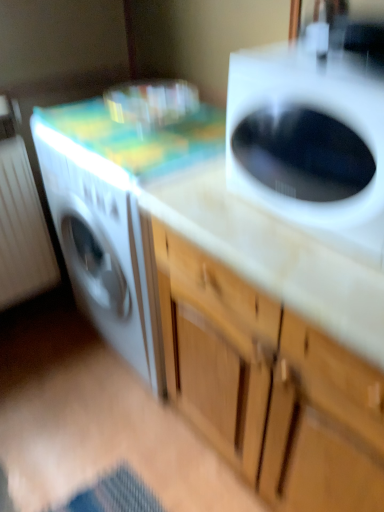
Question: Can you confirm if white glossy washing machine at upper right is positioned to the right of wooden cabinet at center?

Choices:
 (A) no
 (B) yes

Answer: (A)

Question: Is white glossy washing machine at upper right in front of wooden cabinet at center?

Choices:
 (A) no
 (B) yes

Answer: (A)

Question: Considering the relative sizes of white glossy washing machine at upper right and wooden cabinet at center in the image provided, is white glossy washing machine at upper right thinner than wooden cabinet at center?

Choices:
 (A) yes
 (B) no

Answer: (A)

Question: Is white glossy washing machine at upper right surrounding wooden cabinet at center?

Choices:
 (A) no
 (B) yes

Answer: (A)

Question: Is the position of white glossy washing machine at upper right more distant than that of wooden cabinet at center?

Choices:
 (A) no
 (B) yes

Answer: (B)

Question: Does white glossy washing machine at upper right have a lesser height compared to wooden cabinet at center?

Choices:
 (A) yes
 (B) no

Answer: (A)

Question: From a real-world perspective, is wooden cabinet at center located beneath white glossy washing machine at upper right?

Choices:
 (A) yes
 (B) no

Answer: (A)

Question: Is wooden cabinet at center turned away from white glossy washing machine at upper right?

Choices:
 (A) yes
 (B) no

Answer: (B)

Question: Is wooden cabinet at center wider than white glossy washing machine at upper right?

Choices:
 (A) yes
 (B) no

Answer: (A)

Question: Is wooden cabinet at center smaller than white glossy washing machine at upper right?

Choices:
 (A) no
 (B) yes

Answer: (A)

Question: Is wooden cabinet at center directly adjacent to white glossy washing machine at upper right?

Choices:
 (A) no
 (B) yes

Answer: (A)

Question: From the image's perspective, does wooden cabinet at center appear lower than white glossy washing machine at upper right?

Choices:
 (A) yes
 (B) no

Answer: (A)

Question: From the image's perspective, is white glossy washing machine at upper right positioned above or below wooden cabinet at center?

Choices:
 (A) above
 (B) below

Answer: (A)